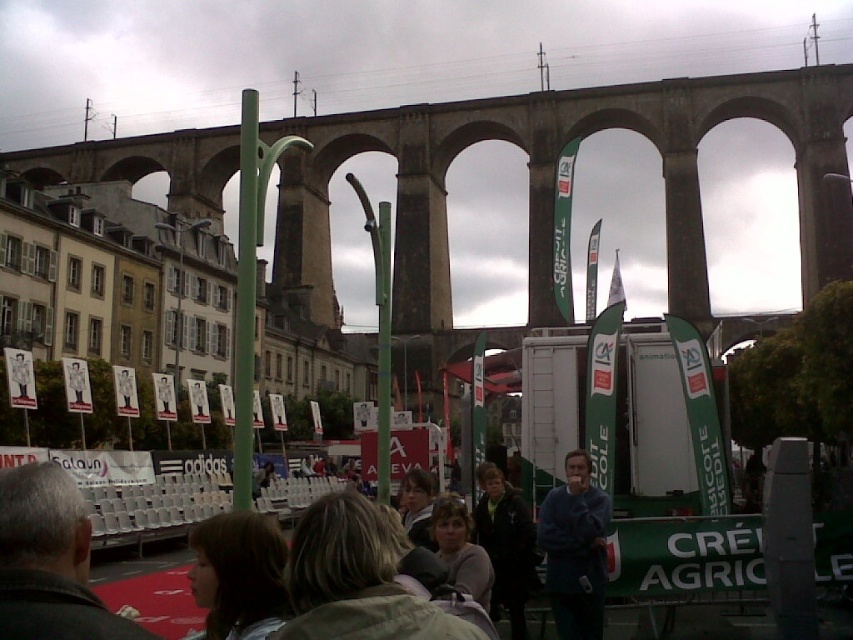
You are a photographer at the event and want to capture a photo of the blonde hair at lower center and the matte gray jacket at center. Based on their widths, which object should you focus on to ensure it fits better in the frame?

The blonde hair at lower center has a greater width than the matte gray jacket at center, so focusing on it would ensure it fits better in the frame.

You are a photographer positioned at the front of the scene. You want to capture a photo that includes both the blonde hair at lower center and the blue fleece at center. Which object should you focus on first to ensure both are in sharp focus?

You should focus on the blonde hair at lower center first since it is closer to the viewer than the blue fleece at center. By focusing on the closer object, the farther object will still be within the depth of field, ensuring both are in focus.